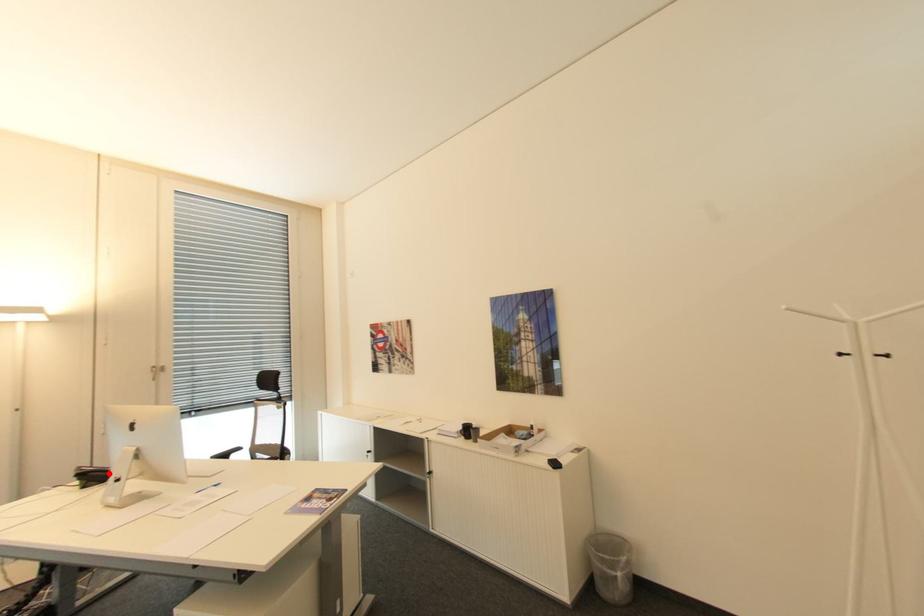
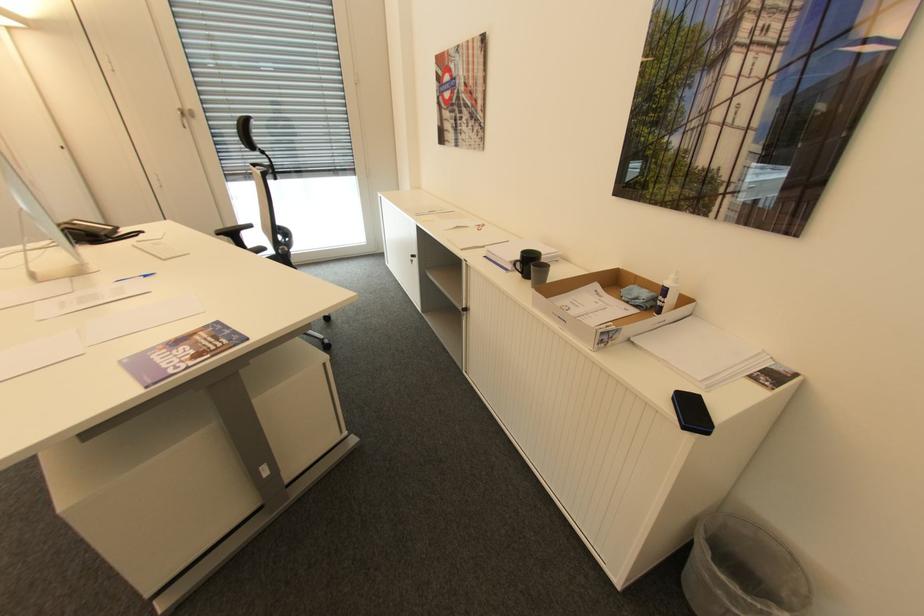
Question: I am providing you with two images of the same scene from different viewpoints. A red point is shown in image1. For the corresponding object point in image2, is it positioned nearer or farther from the camera?

Choices:
 (A) Nearer
 (B) Farther

Answer: (B)